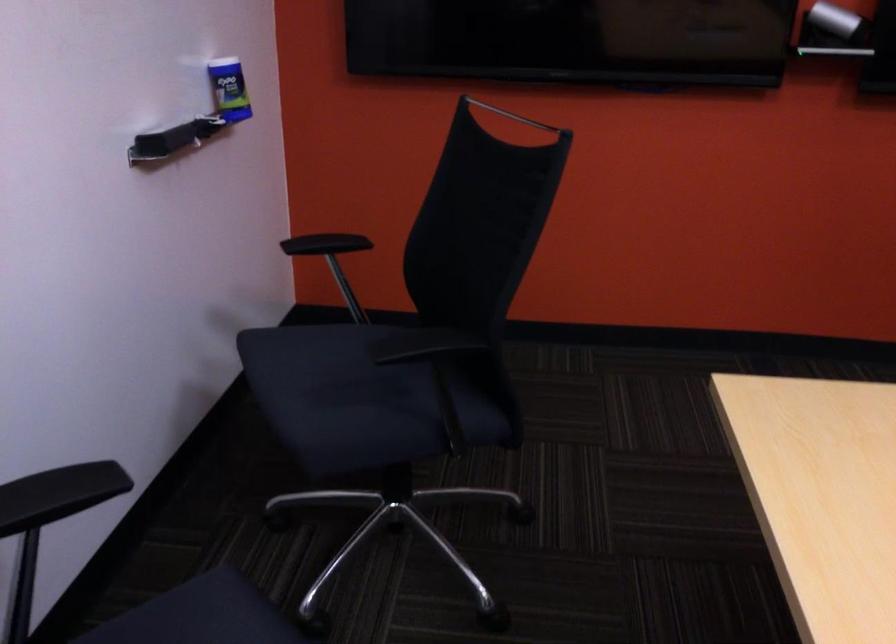
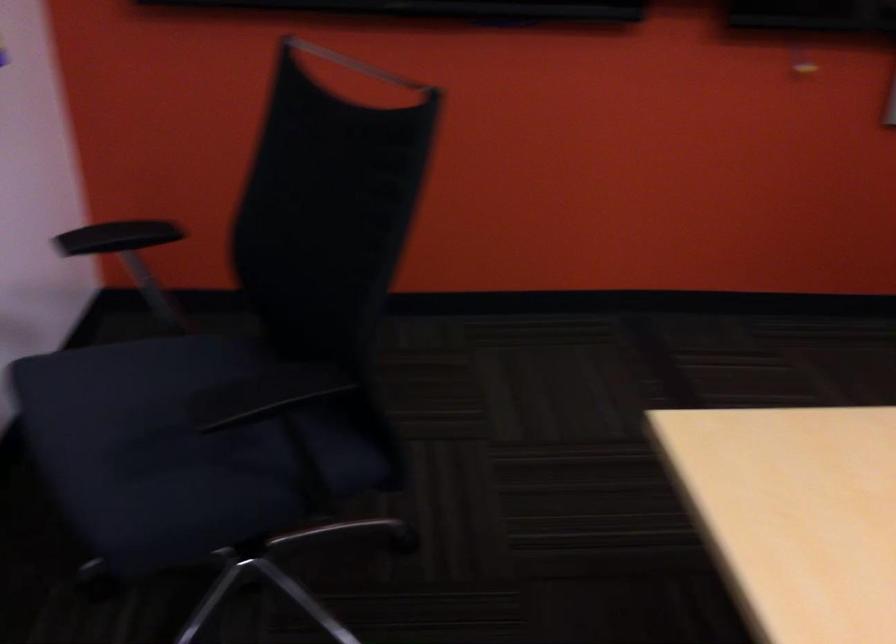
Locate, in the second image, the point that corresponds to point 418,346 in the first image.

(264, 395)